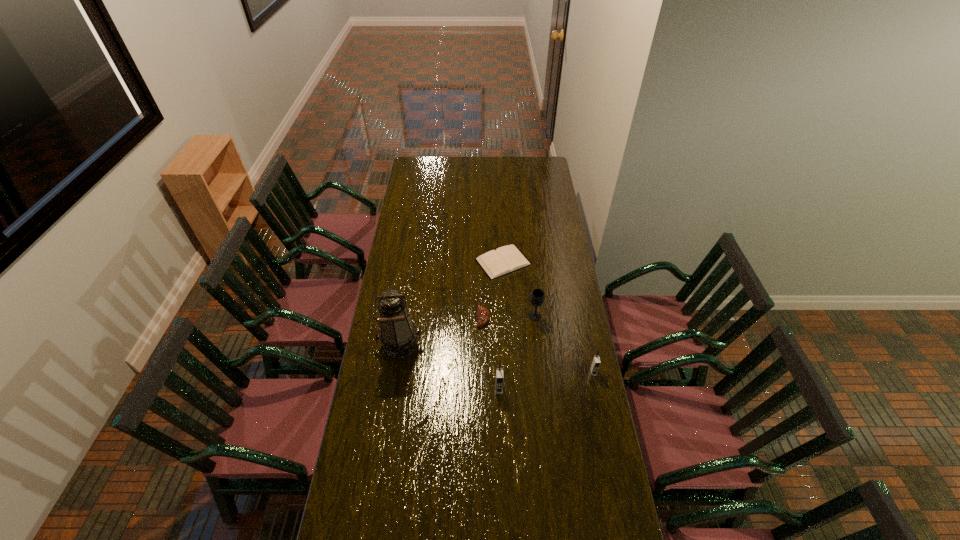
In the current image, all cellular telephones are evenly spaced. To maintain this equal spacing, where should an additional cellular telephone be placed on the left? Please point out a free spot. Please provide its 2D coordinates. Your answer should be formatted as a tuple, i.e. [(x, y)], where the tuple contains the x and y coordinates of a point satisfying the conditions above.

[(398, 407)]